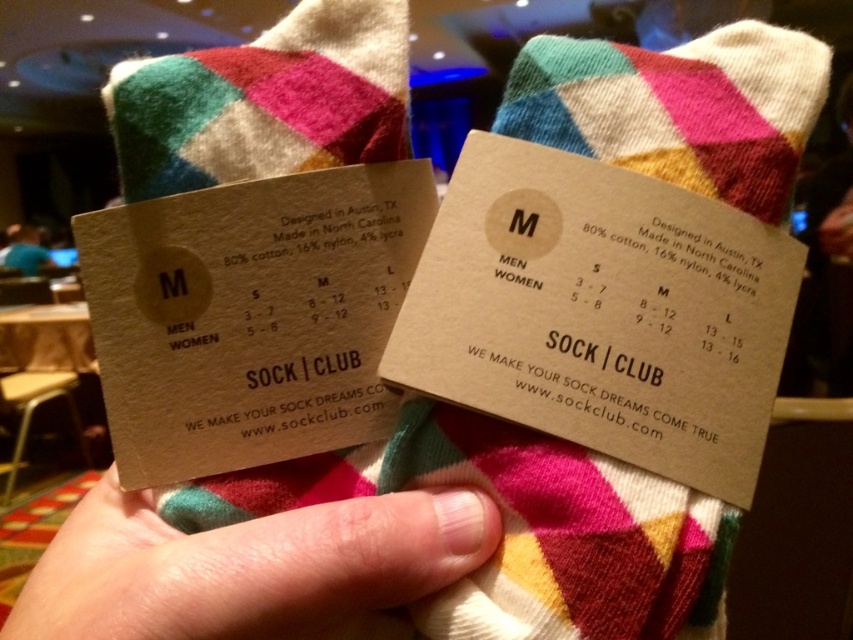
Question: Is multicolored woolen socks at center positioned behind blue fabric shirt at upper left?

Choices:
 (A) no
 (B) yes

Answer: (A)

Question: Is multicolored woolen socks at center wider than blue fabric shirt at upper left?

Choices:
 (A) no
 (B) yes

Answer: (B)

Question: Which is farther from the blue fabric shirt at upper left?

Choices:
 (A) pink skin at center
 (B) multicolored woolen socks at center

Answer: (A)

Question: Which is nearer to the pink skin at center?

Choices:
 (A) multicolored woolen socks at center
 (B) blue fabric shirt at upper left

Answer: (A)

Question: Is pink skin at center behind multicolored woolen socks at center?

Choices:
 (A) no
 (B) yes

Answer: (A)

Question: Which point is closer to the camera taking this photo?

Choices:
 (A) (287, 80)
 (B) (479, 541)

Answer: (B)